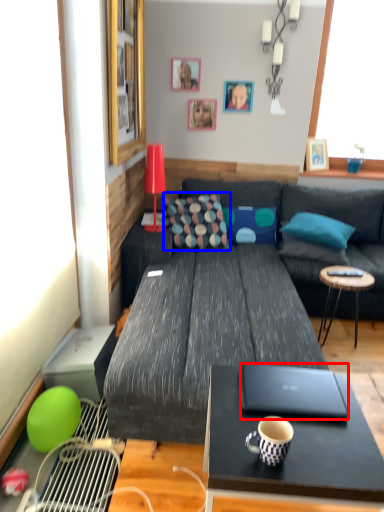
Question: Which of the following is the farthest to the observer, laptop (highlighted by a red box) or pillow (highlighted by a blue box)?

Choices:
 (A) laptop
 (B) pillow

Answer: (B)